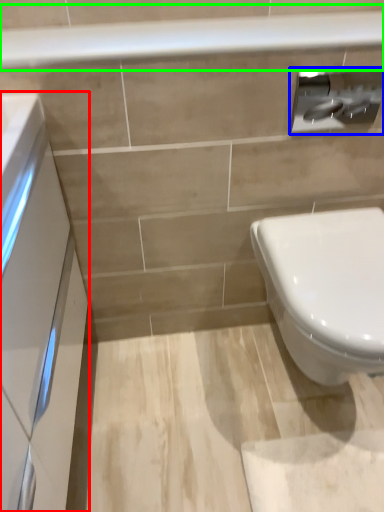
Question: Which object is the closest to the porcelain (highlighted by a red box)? Choose among these: toilet paper (highlighted by a blue box) or balustrade (highlighted by a green box).

Choices:
 (A) toilet paper
 (B) balustrade

Answer: (B)